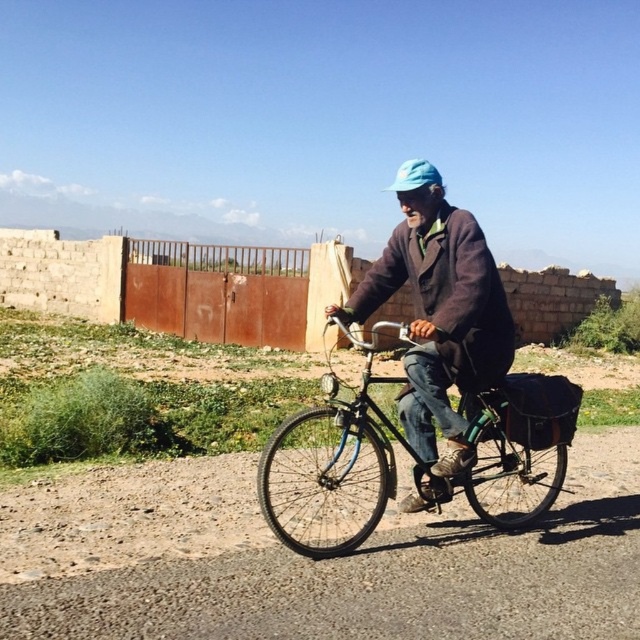
Can you confirm if blue metallic bicycle at center is positioned below dark brown woolen jacket at center?

Yes.

Measure the distance between blue metallic bicycle at center and camera.

blue metallic bicycle at center and camera are 3.02 meters apart.

The width and height of the screenshot is (640, 640). I want to click on blue metallic bicycle at center, so click(333, 465).

How far apart are dirt gravel road at center and blue fabric hat at center?

dirt gravel road at center is 10.68 feet away from blue fabric hat at center.

Which is more to the right, dirt gravel road at center or blue fabric hat at center?

Positioned to the right is blue fabric hat at center.

Is point (212, 598) positioned before point (420, 161)?

That is True.

This screenshot has width=640, height=640. I want to click on dirt gravel road at center, so click(314, 563).

Who is more distant from viewer, (353, 525) or (422, 182)?

Positioned behind is point (353, 525).

Between blue metallic bicycle at center and blue fabric hat at center, which one has less height?

With less height is blue metallic bicycle at center.

Who is more forward, (355, 474) or (401, 176)?

Point (401, 176) is more forward.

Find the location of a particular element. blue metallic bicycle at center is located at coordinates (333, 465).